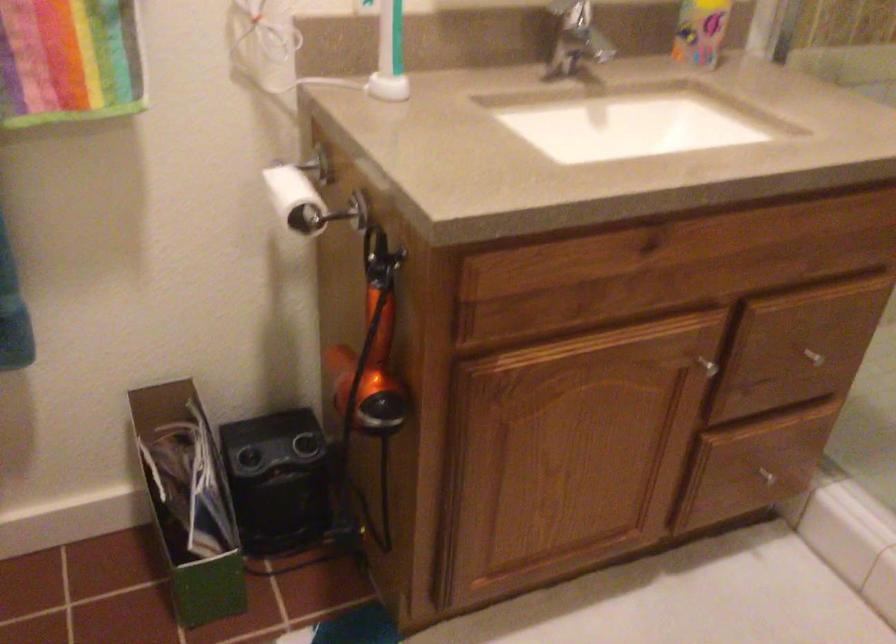
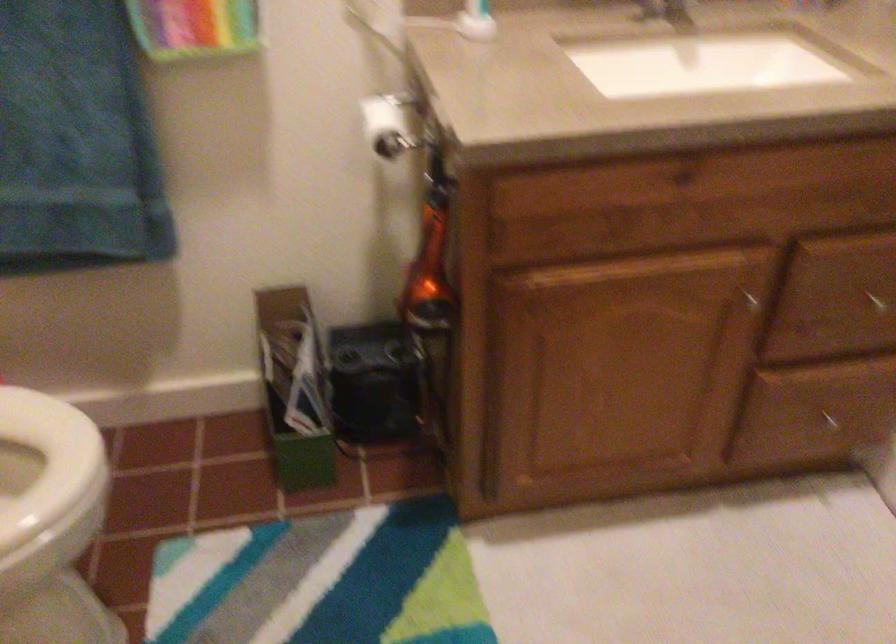
Find the pixel in the second image that matches point 764,474 in the first image.

(831, 422)